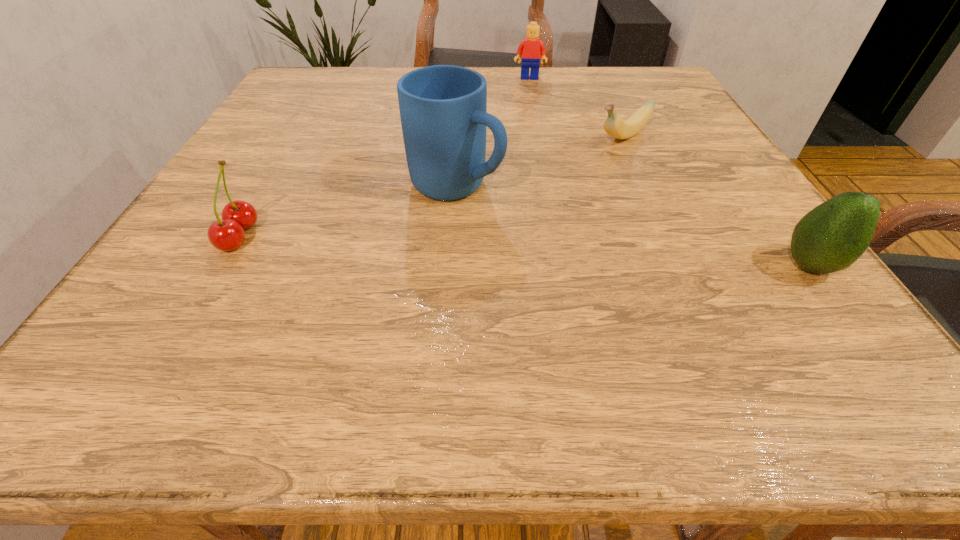
Find the location of a particular element. The width and height of the screenshot is (960, 540). free space on the desktop that is between the leftmost object and the avocado and is positioned on the face of the Lego is located at coordinates pyautogui.click(x=539, y=252).

Locate an element on the screen. vacant space on the desktop that is between the leftmost object and the avocado and is positioned on the side of the tallest object with the handle is located at coordinates (x=599, y=255).

The width and height of the screenshot is (960, 540). Identify the location of vacant space on the desktop that is between the cherry and the avocado and is positioned at the stem of the second farthest object. (452, 247).